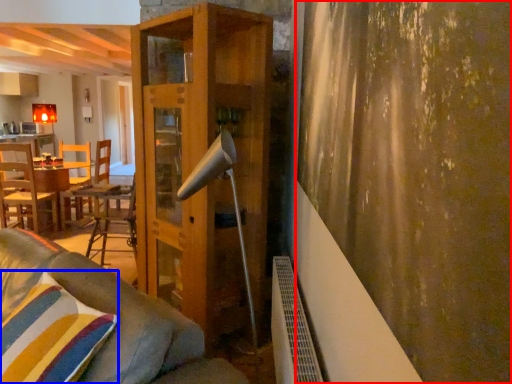
Question: Which of the following is the farthest to the observer, curtain (highlighted by a red box) or pillow (highlighted by a blue box)?

Choices:
 (A) curtain
 (B) pillow

Answer: (B)